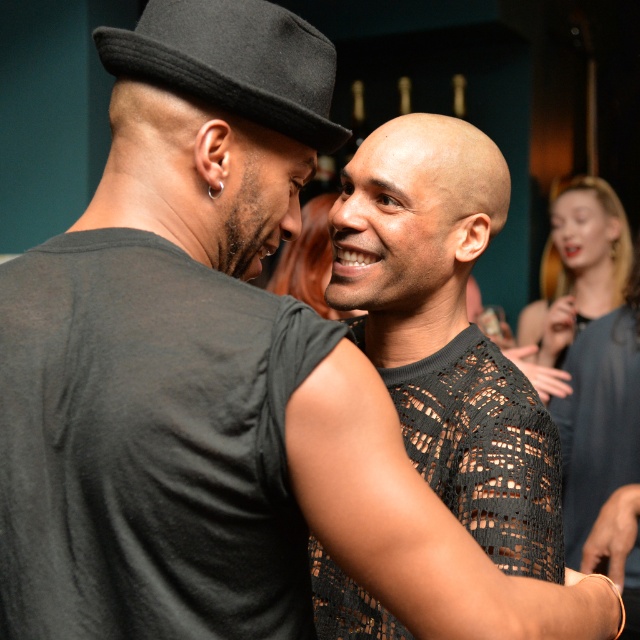
You are at a party and want to take a photo of the bald head at center and the black felt fedora at upper left. Which object should you focus on first if you want to capture both in the frame without moving the camera?

The bald head at center is taller than the black felt fedora at upper left, so you should focus on the bald head at center first to ensure both are in frame.

You are at a party and want to take a photo of the bald head at center and the smooth gray dress at upper right. Which object should you focus on first if you want to capture both in the same frame without moving the camera?

The bald head at center is located below the smooth gray dress at upper right, so you should focus on the smooth gray dress at upper right first to ensure both are in the frame.